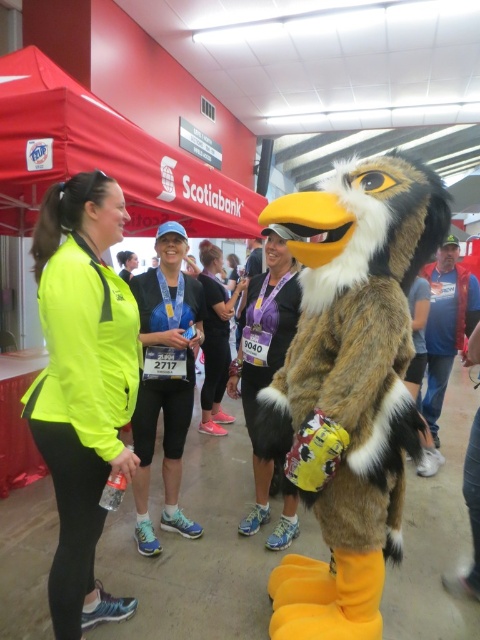
You are a participant in the race and you see both the neon yellow jacket at center and the white fur jacket at center. Which jacket is closer to you?

The neon yellow jacket at center is closer to you because the white fur jacket at center is behind it.